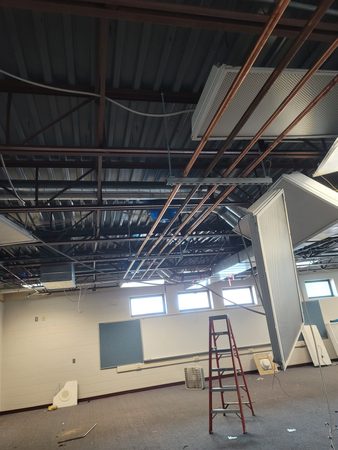
The width and height of the screenshot is (338, 450). What are the coordinates of `wooden door pane` in the screenshot? It's located at (279, 263).